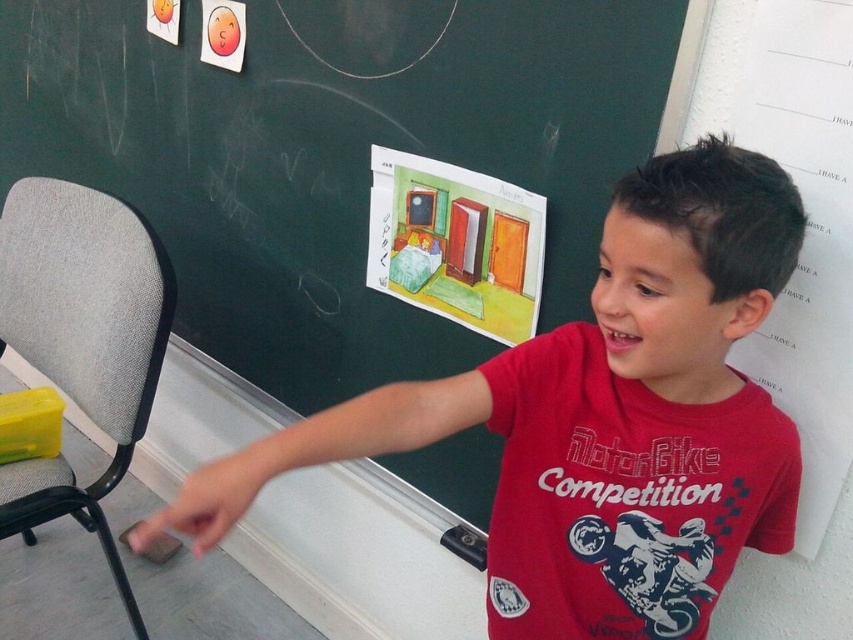
You are a student sitting in the classroom and want to hand your paper to the boy in the red cotton shirt at center. The gray fabric chair at left is where you are currently sitting. Which direction should you move to reach him?

The red cotton shirt at center is to the right of the gray fabric chair at left, so you should move to your right to reach the boy in the red cotton shirt at center.

You are a student sitting at the back of the classroom. You notice two points on the blackboard. The first point is at coordinates point (234, 262) and the second is at point (770, 188). Which point is closer to you?

Point (234, 262) is further to the camera than point (770, 188). Therefore, point (770, 188) is closer to you.